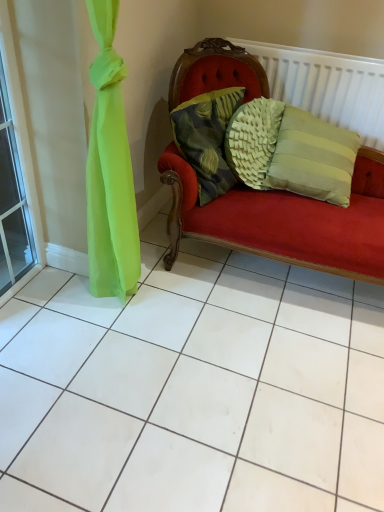
Question: Does white textured radiator at upper right come behind transparent glass window at left?

Choices:
 (A) no
 (B) yes

Answer: (B)

Question: From a real-world perspective, is white textured radiator at upper right over transparent glass window at left?

Choices:
 (A) no
 (B) yes

Answer: (B)

Question: From a real-world perspective, is white textured radiator at upper right positioned under transparent glass window at left based on gravity?

Choices:
 (A) yes
 (B) no

Answer: (B)

Question: Is white textured radiator at upper right at the left side of transparent glass window at left?

Choices:
 (A) no
 (B) yes

Answer: (A)

Question: Does white textured radiator at upper right have a smaller size compared to transparent glass window at left?

Choices:
 (A) no
 (B) yes

Answer: (A)

Question: Considering the relative positions of white textured radiator at upper right and transparent glass window at left in the image provided, is white textured radiator at upper right in front of transparent glass window at left?

Choices:
 (A) yes
 (B) no

Answer: (B)

Question: Is textured green pillow at center located within transparent glass window at left?

Choices:
 (A) yes
 (B) no

Answer: (B)

Question: Considering the relative sizes of transparent glass window at left and textured green pillow at center in the image provided, is transparent glass window at left thinner than textured green pillow at center?

Choices:
 (A) yes
 (B) no

Answer: (A)

Question: From the image's perspective, is transparent glass window at left located above textured green pillow at center?

Choices:
 (A) yes
 (B) no

Answer: (B)

Question: Does transparent glass window at left have a smaller size compared to textured green pillow at center?

Choices:
 (A) yes
 (B) no

Answer: (A)

Question: Does transparent glass window at left appear on the right side of textured green pillow at center?

Choices:
 (A) no
 (B) yes

Answer: (A)

Question: Does transparent glass window at left have a larger size compared to textured green pillow at center?

Choices:
 (A) no
 (B) yes

Answer: (A)

Question: Is white textured radiator at upper right located outside textured green pillow at center?

Choices:
 (A) no
 (B) yes

Answer: (B)